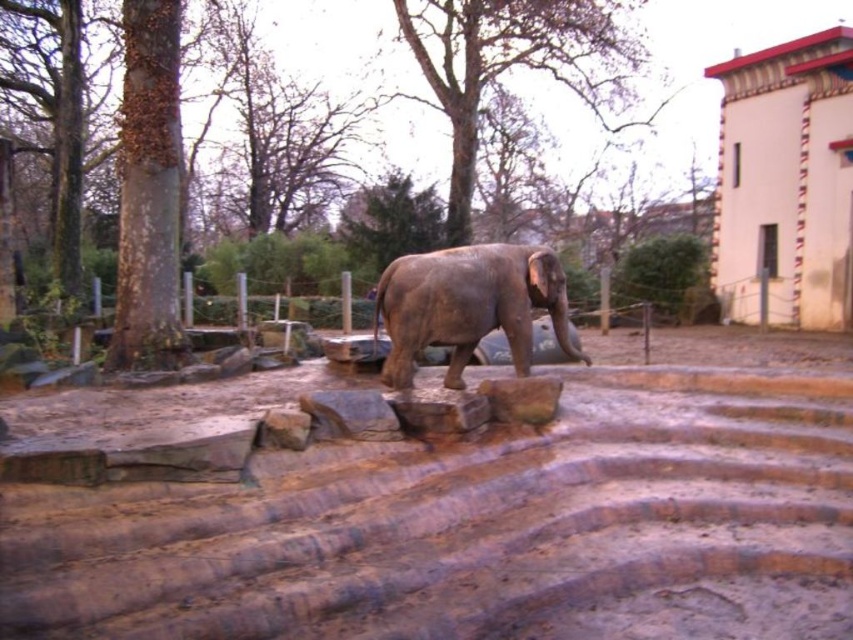
You are standing at the point labeled as point (486,522) in the image. What is the material under your feet?

The material under your feet at point (486,522) is brown sandy dirt at center.

You are an animal keeper at the zoo and need to determine the best area to place a new feeding station. Considering the brown sandy dirt at center and the white painted wall at upper right, which location has more space to accommodate the station?

The white painted wall at upper right has a larger size compared to the brown sandy dirt at center, so the feeding station should be placed there for more space.